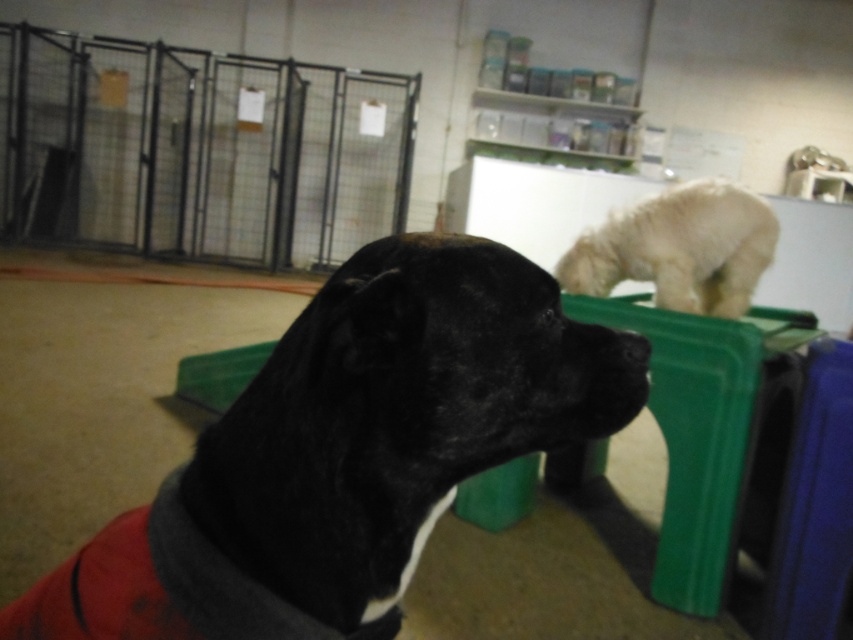
Which of these two, black fur dog at center or white fluffy dog at upper center, stands taller?

Standing taller between the two is black fur dog at center.

Can you confirm if black fur dog at center is smaller than white fluffy dog at upper center?

Yes.

Locate an element on the screen. This screenshot has height=640, width=853. black fur dog at center is located at coordinates (347, 452).

Find the location of a particular element. Image resolution: width=853 pixels, height=640 pixels. black fur dog at center is located at coordinates (347, 452).